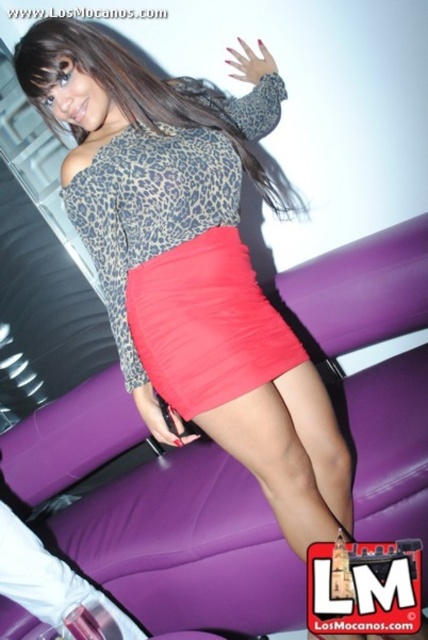
Does shiny coral skirt at center appear over leopard print dress at center?

No, shiny coral skirt at center is not above leopard print dress at center.

Between point (208, 280) and point (65, 54), which one is positioned behind?

The point (208, 280) is more distant.

Between point (226, 272) and point (258, 168), which one is positioned behind?

The point (258, 168) is more distant.

This screenshot has height=640, width=428. What are the coordinates of `shiny coral skirt at center` in the screenshot? It's located at (207, 323).

Can you confirm if matte red skirt at center is shorter than leopard print dress at center?

Incorrect, matte red skirt at center's height does not fall short of leopard print dress at center's.

Locate an element on the screen. matte red skirt at center is located at coordinates (149, 209).

Does matte red skirt at center appear on the left side of shiny coral skirt at center?

Correct, you'll find matte red skirt at center to the left of shiny coral skirt at center.

Does matte red skirt at center appear under shiny coral skirt at center?

Actually, matte red skirt at center is above shiny coral skirt at center.

Is point (189, 88) positioned before point (285, 337)?

No.

Locate an element on the screen. The width and height of the screenshot is (428, 640). matte red skirt at center is located at coordinates (149, 209).